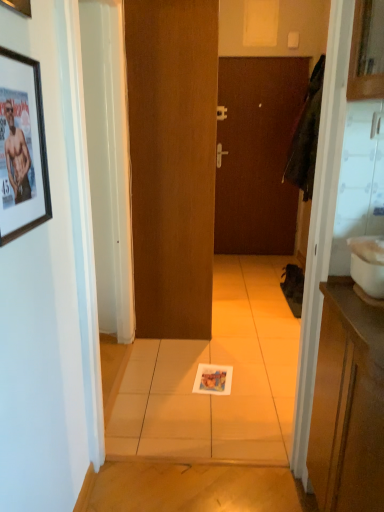
The width and height of the screenshot is (384, 512). In order to click on free point above matte paper magazine at center (from a real-world perspective) in this screenshot , I will do `click(210, 377)`.